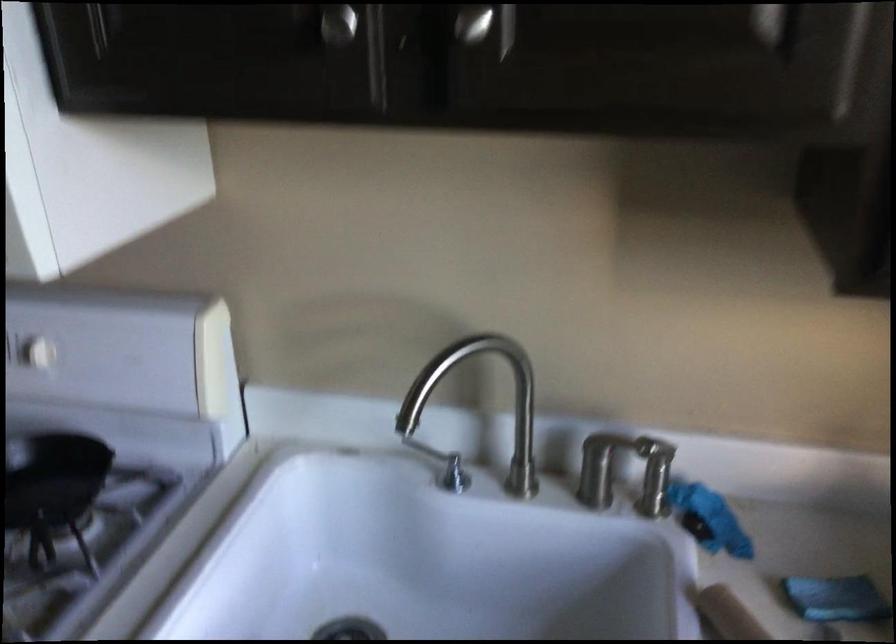
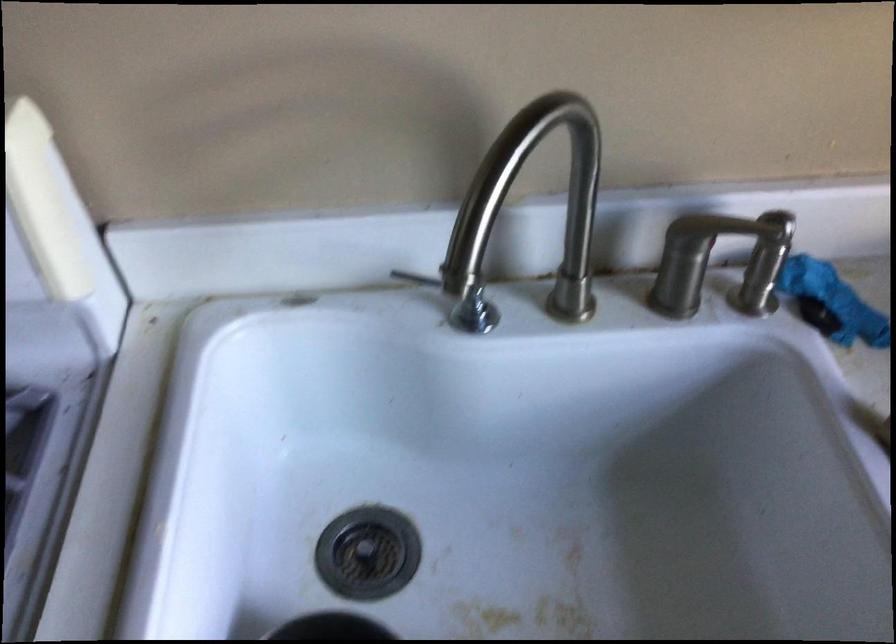
In a continuous first-person perspective shot, in which direction is the camera moving?

The cameraman moved toward left, forward.